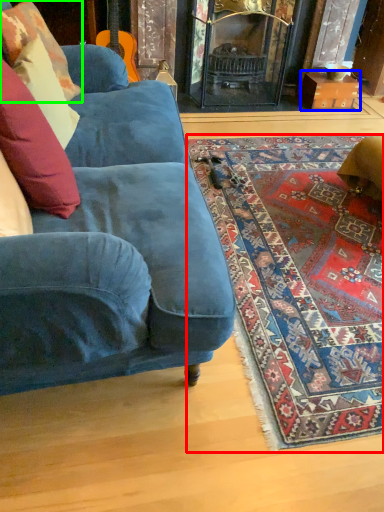
Question: Which object is positioned closest to mat (highlighted by a red box)? Select from cardboard box (highlighted by a blue box) and pillow (highlighted by a green box).

Choices:
 (A) cardboard box
 (B) pillow

Answer: (B)